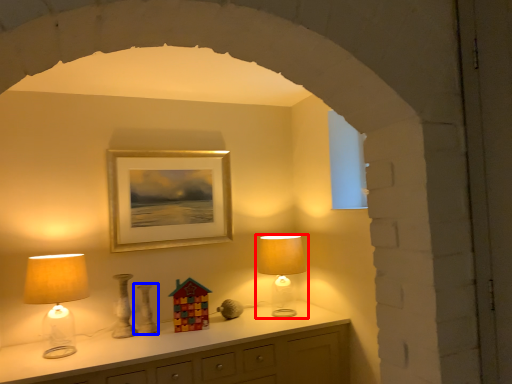
Question: Which object appears farthest to the camera in this image, lamp (highlighted by a red box) or vase (highlighted by a blue box)?

Choices:
 (A) lamp
 (B) vase

Answer: (A)